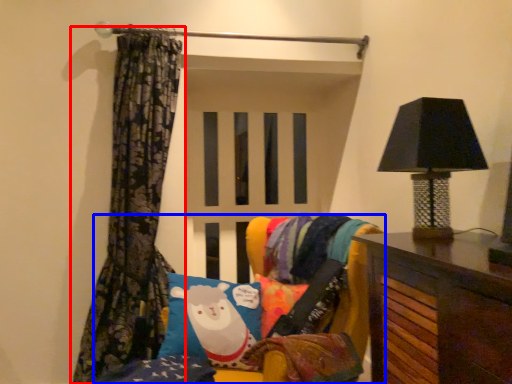
Question: Which point is closer to the camera, curtain (highlighted by a red box) or furniture (highlighted by a blue box)?

Choices:
 (A) curtain
 (B) furniture

Answer: (B)